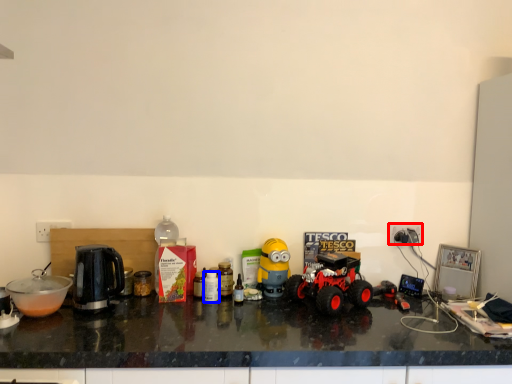
Question: Among these objects, which one is farthest to the camera, power outlet (highlighted by a red box) or bottle (highlighted by a blue box)?

Choices:
 (A) power outlet
 (B) bottle

Answer: (A)